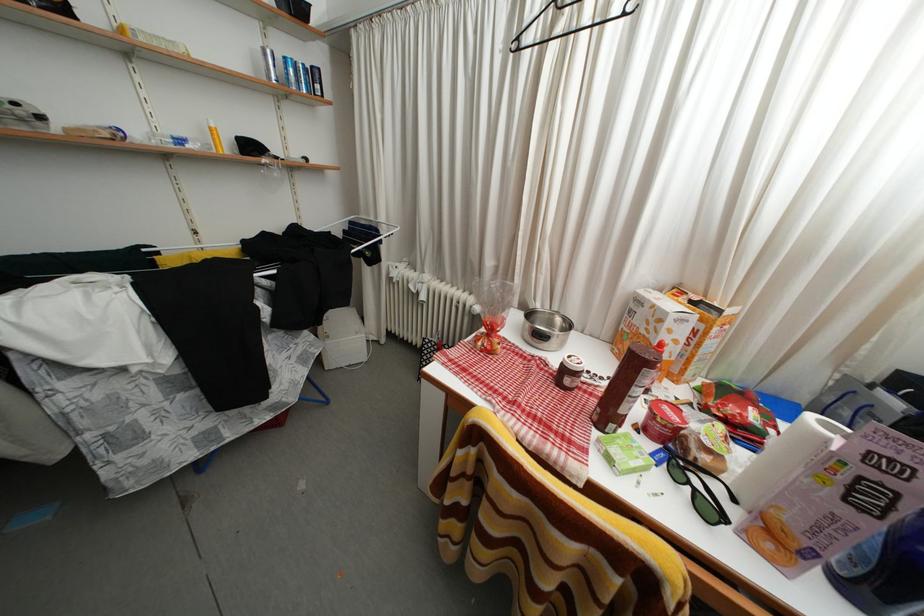
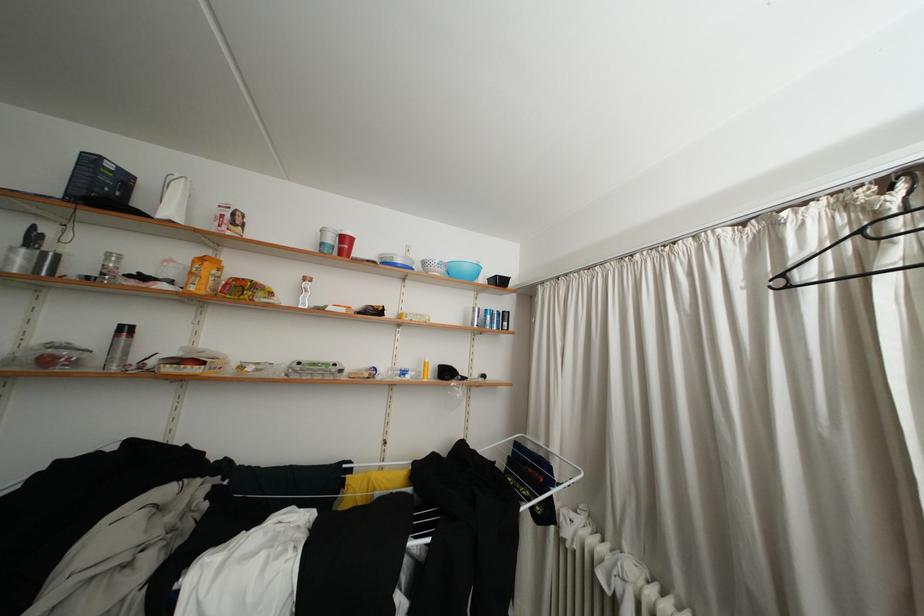
Find the pixel in the second image that matches point (380, 224) in the first image.

(550, 448)